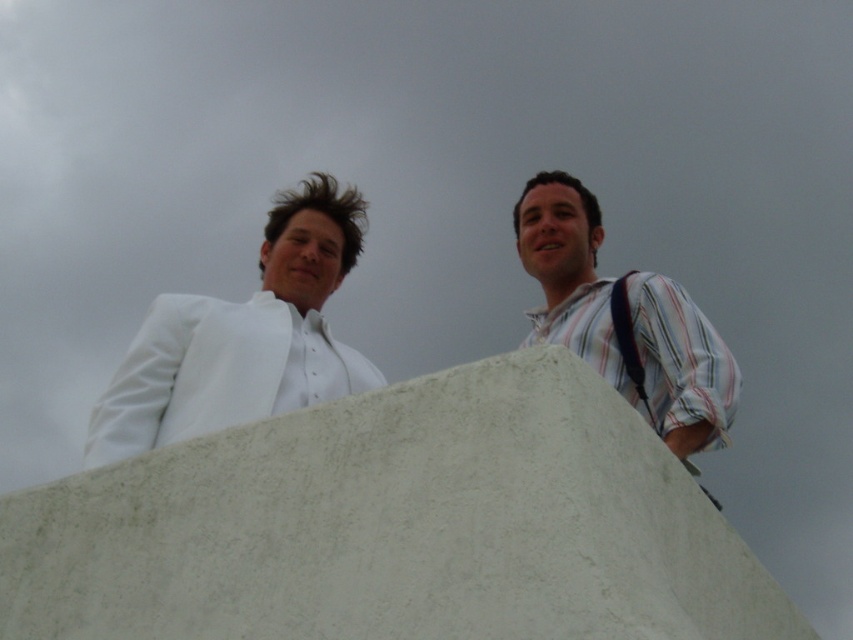
Question: Can you confirm if white rough concrete at center is bigger than black fabric strap at right?

Choices:
 (A) yes
 (B) no

Answer: (A)

Question: Can you confirm if striped cotton shirt at upper right is bigger than black fabric strap at right?

Choices:
 (A) yes
 (B) no

Answer: (A)

Question: Does white rough concrete at center have a lesser width compared to white matte suit at upper left?

Choices:
 (A) yes
 (B) no

Answer: (B)

Question: Estimate the real-world distances between objects in this image. Which object is closer to the striped cotton shirt at upper right?

Choices:
 (A) white matte suit at upper left
 (B) black fabric strap at right

Answer: (B)

Question: Which point is farther to the camera?

Choices:
 (A) (123, 547)
 (B) (618, 300)

Answer: (B)

Question: Which point is farther to the camera?

Choices:
 (A) (625, 390)
 (B) (119, 490)

Answer: (A)